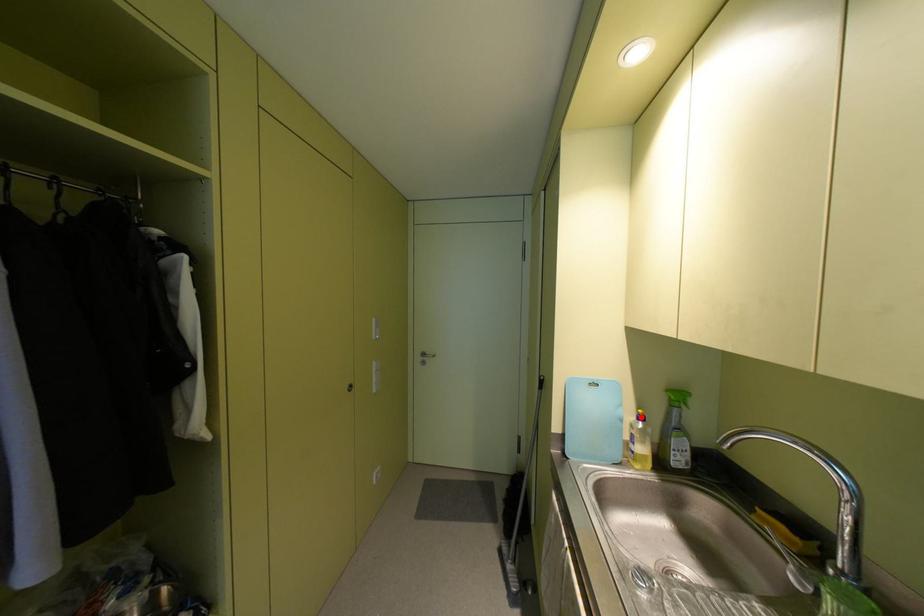
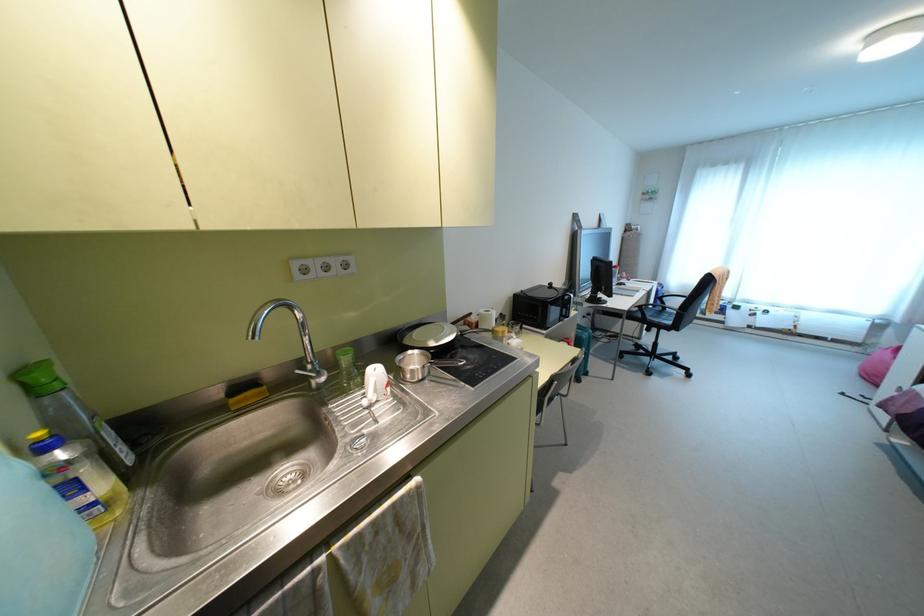
The point at the highlighted location is marked in the first image. Where is the corresponding point in the second image?

(43, 447)